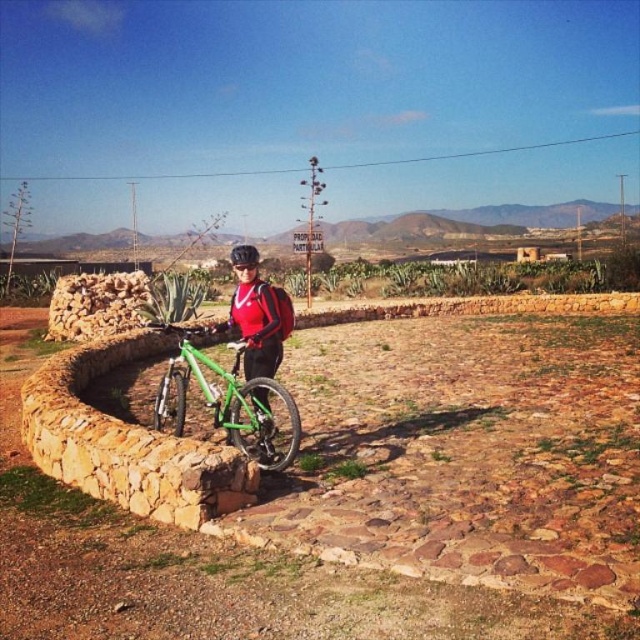
This screenshot has height=640, width=640. I want to click on matte red jacket at center, so click(x=259, y=321).

Does matte red jacket at center have a greater height compared to black matte bicycle helmet at center?

Incorrect, matte red jacket at center's height is not larger of black matte bicycle helmet at center's.

Image resolution: width=640 pixels, height=640 pixels. Find the location of `matte red jacket at center`. matte red jacket at center is located at coordinates (259, 321).

Which of these two, green matte bicycle at center or matte red jacket at center, stands taller?

matte red jacket at center

Who is shorter, green matte bicycle at center or matte red jacket at center?

green matte bicycle at center

This screenshot has height=640, width=640. Identify the location of green matte bicycle at center. (225, 401).

Can you confirm if green matte bicycle at center is smaller than black matte bicycle helmet at center?

Correct, green matte bicycle at center occupies less space than black matte bicycle helmet at center.

Is point (195, 369) positioned behind point (240, 259)?

Yes, it is behind point (240, 259).

Is point (193, 332) positioned in front of point (243, 244)?

Yes, it is in front of point (243, 244).

In order to click on green matte bicycle at center in this screenshot , I will do `click(225, 401)`.